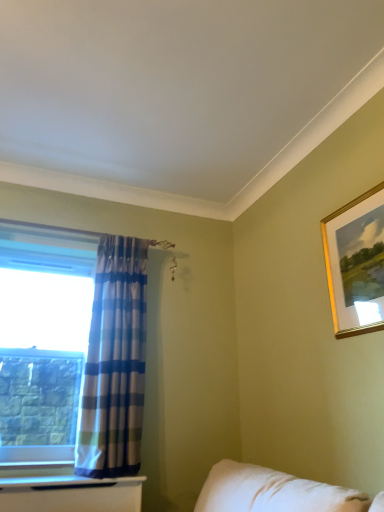
Question: Does gold-framed picture at upper right appear on the right side of blue plaid fabric curtain at left?

Choices:
 (A) no
 (B) yes

Answer: (B)

Question: Does gold-framed picture at upper right appear on the left side of blue plaid fabric curtain at left?

Choices:
 (A) yes
 (B) no

Answer: (B)

Question: Would you say blue plaid fabric curtain at left is part of gold-framed picture at upper right's contents?

Choices:
 (A) no
 (B) yes

Answer: (A)

Question: Does gold-framed picture at upper right turn towards blue plaid fabric curtain at left?

Choices:
 (A) yes
 (B) no

Answer: (B)

Question: Can we say gold-framed picture at upper right lies outside blue plaid fabric curtain at left?

Choices:
 (A) yes
 (B) no

Answer: (A)

Question: Considering the relative sizes of gold-framed picture at upper right and blue plaid fabric curtain at left in the image provided, is gold-framed picture at upper right shorter than blue plaid fabric curtain at left?

Choices:
 (A) no
 (B) yes

Answer: (B)

Question: Is clear glass window at left wider than blue plaid fabric curtain at left?

Choices:
 (A) no
 (B) yes

Answer: (A)

Question: Does clear glass window at left have a lesser height compared to blue plaid fabric curtain at left?

Choices:
 (A) yes
 (B) no

Answer: (A)

Question: Could you tell me if clear glass window at left is turned towards blue plaid fabric curtain at left?

Choices:
 (A) no
 (B) yes

Answer: (A)

Question: From the image's perspective, is clear glass window at left on top of blue plaid fabric curtain at left?

Choices:
 (A) no
 (B) yes

Answer: (A)

Question: Is clear glass window at left smaller than blue plaid fabric curtain at left?

Choices:
 (A) no
 (B) yes

Answer: (A)

Question: Is clear glass window at left taller than blue plaid fabric curtain at left?

Choices:
 (A) no
 (B) yes

Answer: (A)

Question: Could you tell me if blue plaid fabric curtain at left is turned towards gold-framed picture at upper right?

Choices:
 (A) yes
 (B) no

Answer: (B)